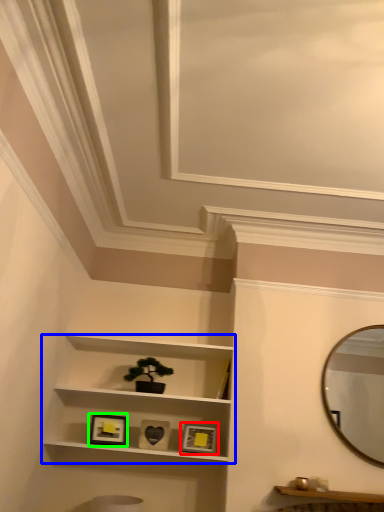
Question: Considering the real-world distances, which object is farthest from picture frame (highlighted by a red box)? shelf (highlighted by a blue box) or picture frame (highlighted by a green box)?

Choices:
 (A) shelf
 (B) picture frame

Answer: (B)